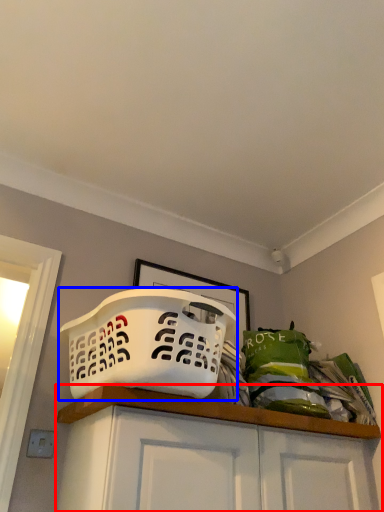
Question: Which object appears farthest to the camera in this image, cabinetry (highlighted by a red box) or basket (highlighted by a blue box)?

Choices:
 (A) cabinetry
 (B) basket

Answer: (B)